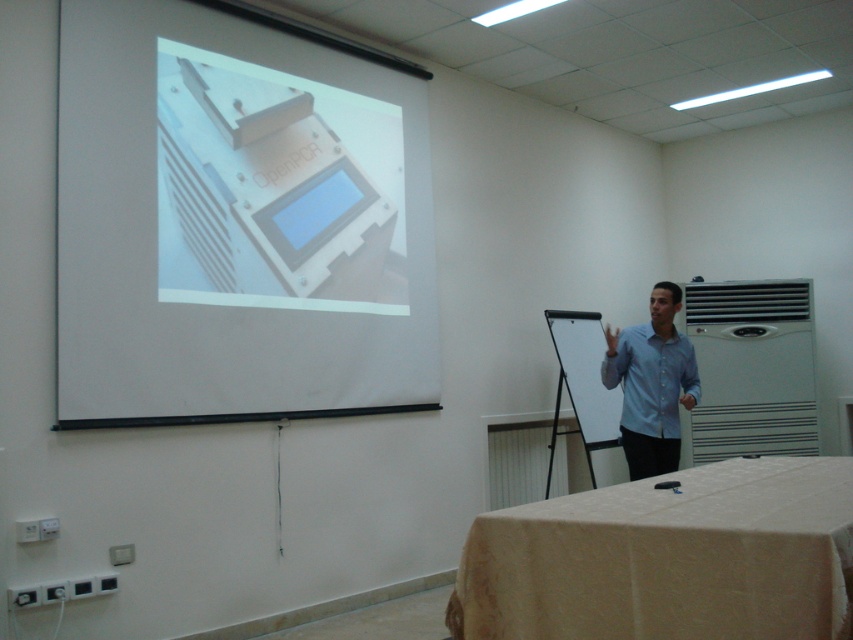
Is white matte projector screen at upper left below beige fabric table at lower right?

Actually, white matte projector screen at upper left is above beige fabric table at lower right.

Is white matte projector screen at upper left above beige fabric table at lower right?

Indeed, white matte projector screen at upper left is positioned over beige fabric table at lower right.

Does point (339, 284) come in front of point (828, 540)?

No, (339, 284) is behind (828, 540).

Locate an element on the screen. white matte projector screen at upper left is located at coordinates (236, 221).

Which is below, white matte projector screen at upper left or light blue shirt at center?

Positioned lower is light blue shirt at center.

The height and width of the screenshot is (640, 853). Describe the element at coordinates (236, 221) in the screenshot. I see `white matte projector screen at upper left` at that location.

Find the location of a particular element. white matte projector screen at upper left is located at coordinates (236, 221).

Who is taller, beige fabric table at lower right or blue plastic screen at upper center?

With more height is blue plastic screen at upper center.

Looking at this image, does beige fabric table at lower right have a larger size compared to blue plastic screen at upper center?

Yes.

Who is more distant from viewer, (473,573) or (345,170)?

Positioned behind is point (345,170).

Where is `beige fabric table at lower right`? Image resolution: width=853 pixels, height=640 pixels. beige fabric table at lower right is located at coordinates (668, 557).